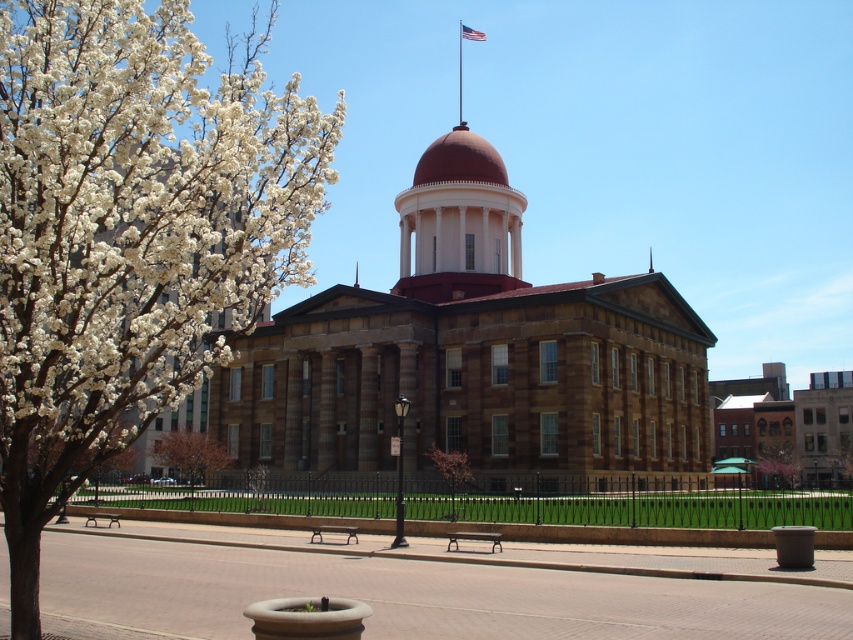
You are a GUI agent. You are given a task and a screenshot of the screen. Output one action in this format:
    pyautogui.click(x=<x>, y=<y>)
    Task: Click on the metallic polished bench at center
    The image size is (853, 640).
    Given the screenshot: What is the action you would take?
    pyautogui.click(x=474, y=538)

Is metallic polished bench at center positioned behind metallic flag pole at center?

No, it is not.

Which is behind, point (491, 532) or point (460, 44)?

Point (460, 44)

What are the coordinates of `metallic polished bench at center` in the screenshot? It's located at (474, 538).

Who is higher up, bare branches at center or metallic flag pole at upper center?

metallic flag pole at upper center is higher up.

The width and height of the screenshot is (853, 640). I want to click on bare branches at center, so pos(776,461).

Between point (770, 472) and point (461, 104), which one is positioned in front?

Point (770, 472)

Identify the location of bare branches at center. (776, 461).

From the picture: Does white blossoms at left have a greater height compared to metallic flag pole at upper center?

Indeed, white blossoms at left has a greater height compared to metallic flag pole at upper center.

Is point (126, 392) closer to viewer compared to point (457, 72)?

Yes, point (126, 392) is in front of point (457, 72).

The image size is (853, 640). I want to click on white blossoms at left, so click(131, 236).